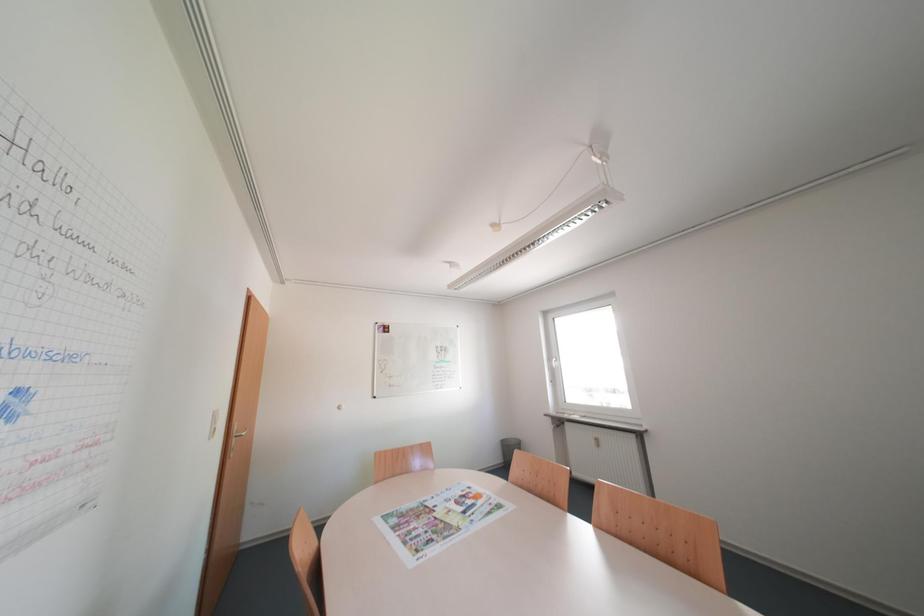
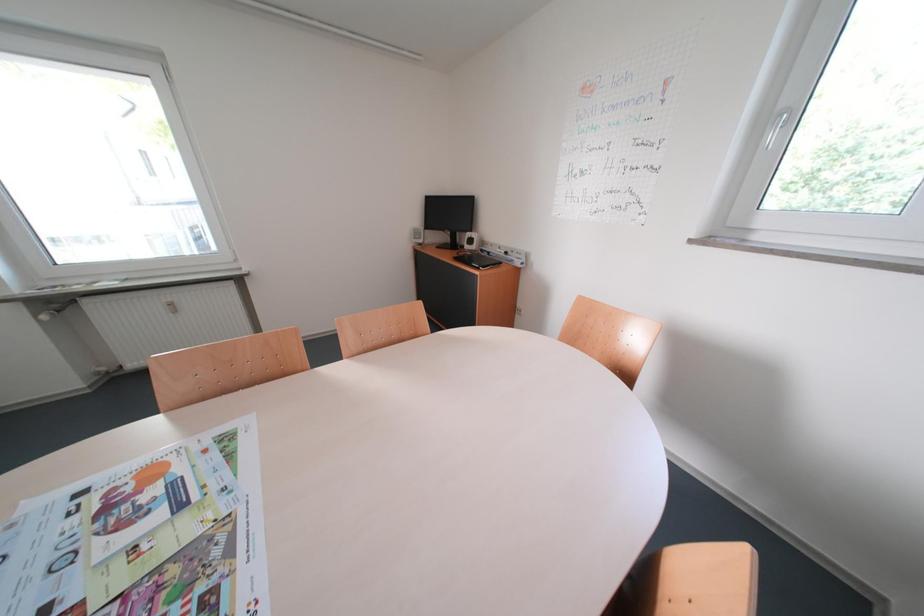
First-person continuous shooting, in which direction is the camera rotating?

The camera rotated toward right-down.